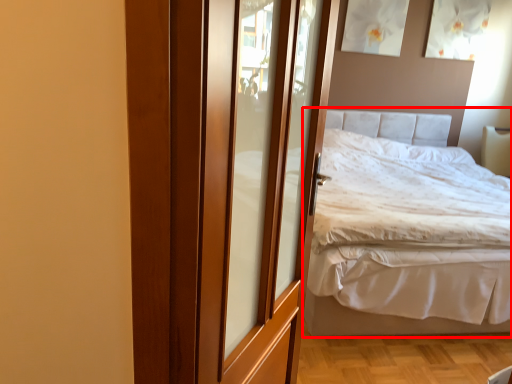
Question: From the image's perspective, where is bed (annotated by the red box) located relative to door?

Choices:
 (A) below
 (B) above

Answer: (B)